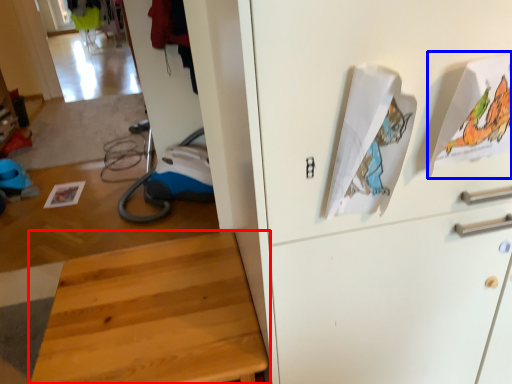
Question: Which of the following is the closest to the observer, furniture (highlighted by a red box) or wrapping paper (highlighted by a blue box)?

Choices:
 (A) furniture
 (B) wrapping paper

Answer: (B)